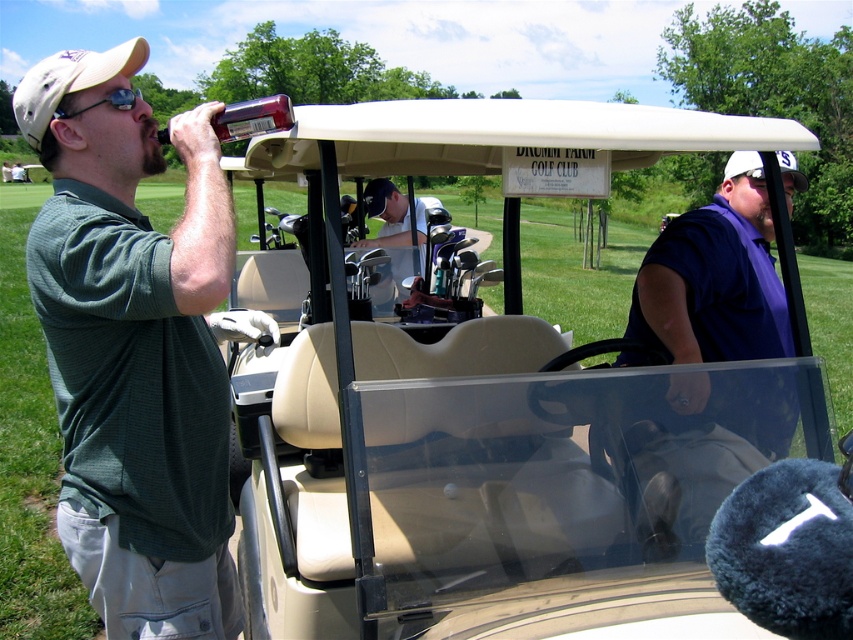
Question: Which object is the closest to the beige plastic golf cart at center?

Choices:
 (A) translucent plastic bottle at upper left
 (B) purple cotton shirt at center

Answer: (B)

Question: Which is nearer to the translucent plastic bottle at upper left?

Choices:
 (A) green matte shirt at left
 (B) beige plastic golf cart at center
 (C) purple cotton shirt at center

Answer: (A)

Question: Is beige plastic golf cart at center positioned behind metallic golf clubs at center?

Choices:
 (A) no
 (B) yes

Answer: (A)

Question: Can you confirm if purple cotton shirt at center is bigger than metallic golf clubs at center?

Choices:
 (A) yes
 (B) no

Answer: (B)

Question: Which point appears closest to the camera in this image?

Choices:
 (A) (109, 122)
 (B) (419, 198)

Answer: (A)

Question: Does beige plastic golf cart at center have a greater width compared to purple cotton shirt at center?

Choices:
 (A) yes
 (B) no

Answer: (A)